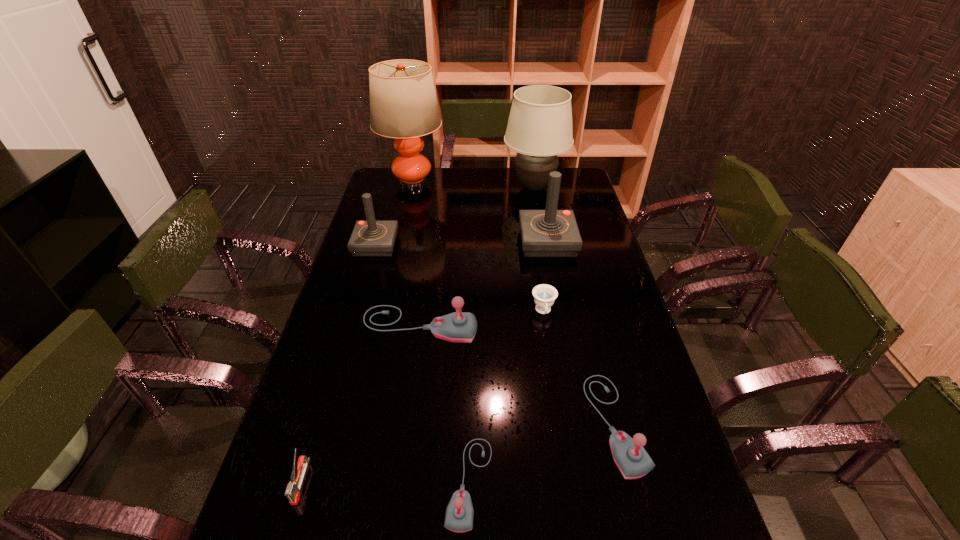
You are a GUI agent. You are given a task and a screenshot of the screen. Output one action in this format:
    pyautogui.click(x=<x>, y=<y>)
    Task: Click on the tallest object
    The image size is (960, 540).
    Given the screenshot: What is the action you would take?
    pyautogui.click(x=403, y=104)

Identify the location of orange lamp. (403, 104).

The width and height of the screenshot is (960, 540). What are the coordinates of `lampshade` in the screenshot? It's located at (539, 128).

Locate an element on the screen. Image resolution: width=960 pixels, height=540 pixels. the seventh shortest object is located at coordinates (544, 233).

I want to click on the bigger red joystick, so click(x=544, y=233).

Where is `the smaller red joystick`? The width and height of the screenshot is (960, 540). the smaller red joystick is located at coordinates (371, 238).

Where is `the sixth shortest object`? This screenshot has width=960, height=540. the sixth shortest object is located at coordinates (371, 238).

The height and width of the screenshot is (540, 960). In order to click on the farthest gray joystick in this screenshot , I will do `click(459, 326)`.

Where is `the third shortest joystick`? The image size is (960, 540). the third shortest joystick is located at coordinates (459, 326).

At what (x,y) coordinates should I click in order to perform the action: click on the second shortest joystick. Please return your answer as a coordinate pair (x, y). Image resolution: width=960 pixels, height=540 pixels. Looking at the image, I should click on coord(629,455).